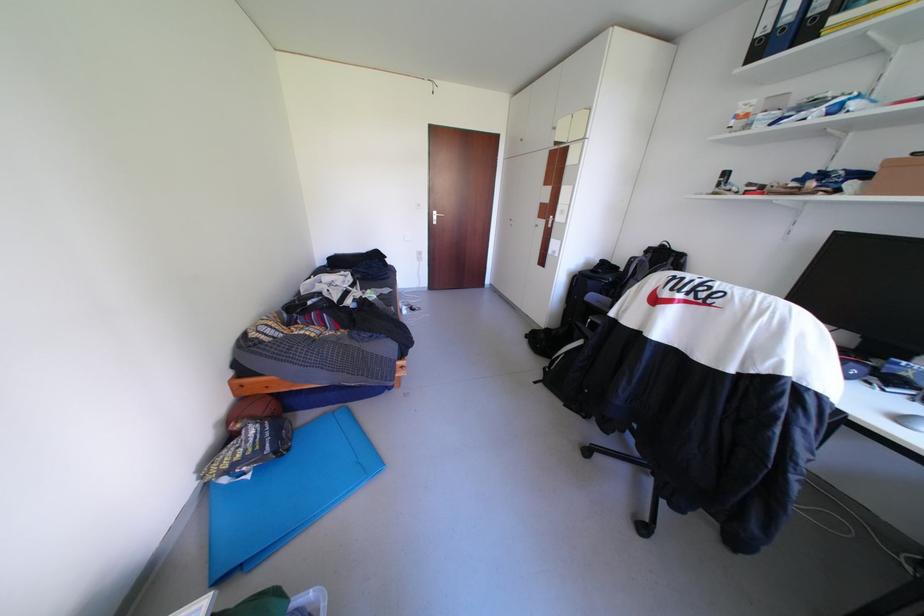
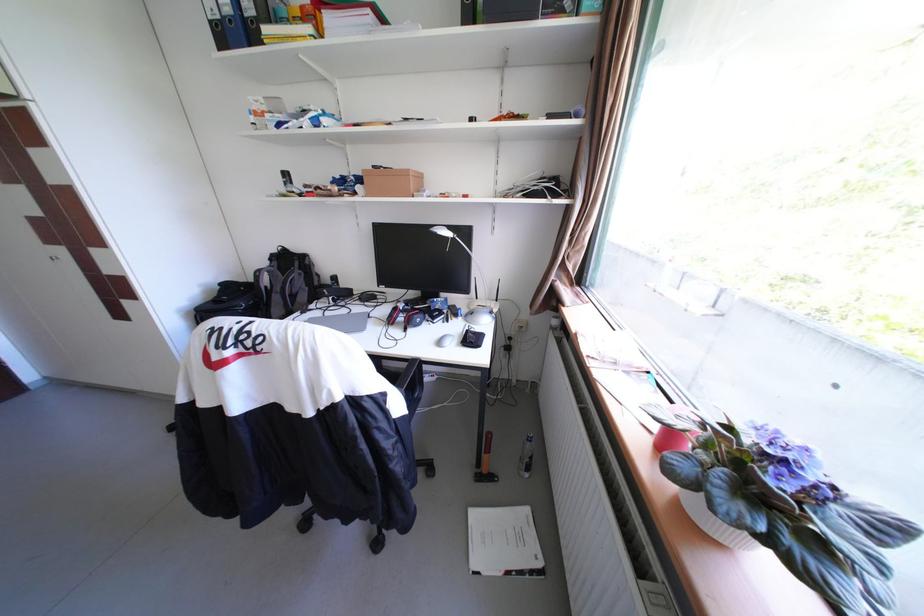
Question: The camera is either moving clockwise (left) or counter-clockwise (right) around the object. The first image is from the beginning of the video and the second image is from the end. Is the camera moving left or right when shooting the video?

Choices:
 (A) Left
 (B) Right

Answer: (A)